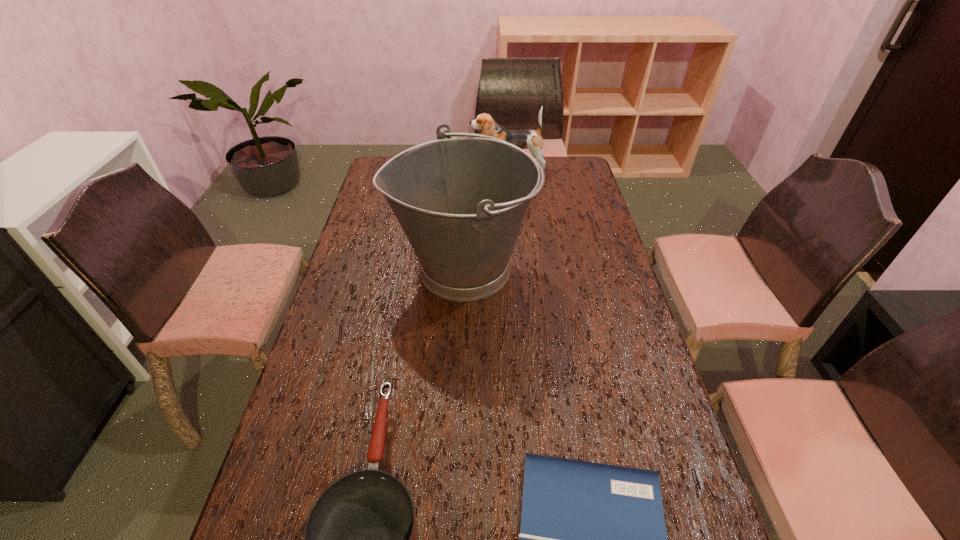
You are a GUI agent. You are given a task and a screenshot of the screen. Output one action in this format:
    pyautogui.click(x=<x>, y=<y>)
    Task: Click on the vacant space at the left edge
    
    Given the screenshot: What is the action you would take?
    pyautogui.click(x=379, y=299)

Identify the location of vacant space at the right edge of the desktop. This screenshot has width=960, height=540. (608, 437).

At what (x,y) coordinates should I click in order to perform the action: click on vacant space at the far right corner of the desktop. Please return your answer as a coordinate pair (x, y). Looking at the image, I should click on (560, 173).

This screenshot has width=960, height=540. I want to click on object that is the second closest to the pan, so click(x=461, y=201).

Locate which object ranks third in proximity to the shortest object. Please provide its 2D coordinates. Your answer should be formatted as a tuple, i.e. [(x, y)], where the tuple contains the x and y coordinates of a point satisfying the conditions above.

[(525, 139)]